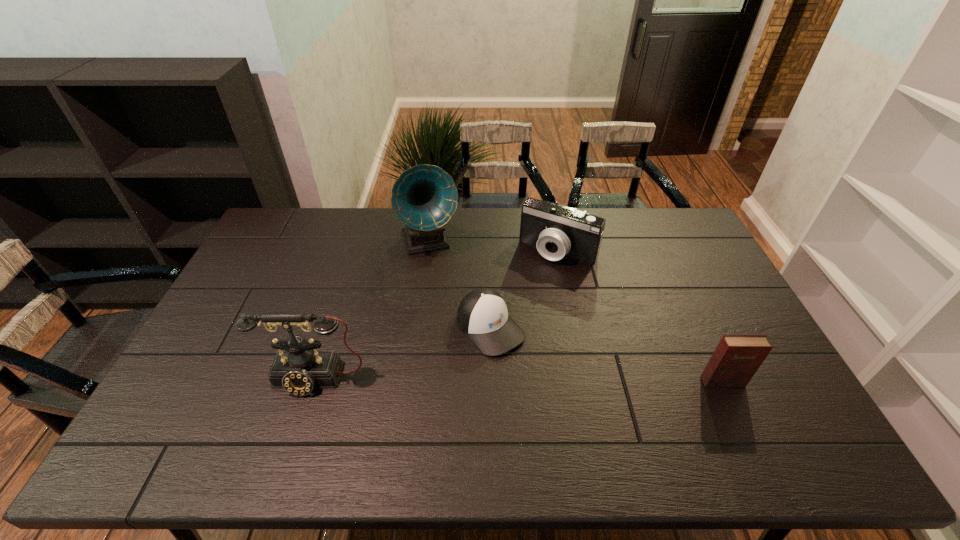
Identify the location of free space on the desktop that is between the leftmost object and the rightmost object and is positioned on the lens of the fourth object from left to right. The height and width of the screenshot is (540, 960). point(476,380).

Image resolution: width=960 pixels, height=540 pixels. In order to click on vacant spot on the desktop that is between the telephone and the diary and is positioned from the horn of the tallest object in this screenshot , I will do `click(476, 380)`.

At what (x,y) coordinates should I click in order to perform the action: click on free space on the desktop that is between the telephone and the rightmost object and is positioned on the front panel of the shortest object. Please return your answer as a coordinate pair (x, y). Looking at the image, I should click on (539, 380).